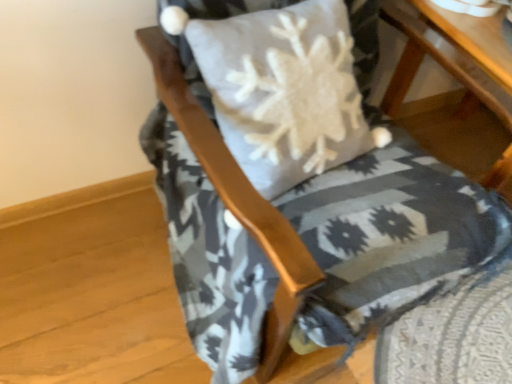
Question: Considering the relative positions of textured gray cushion at center and wooden table at lower right in the image provided, is textured gray cushion at center to the right of wooden table at lower right from the viewer's perspective?

Choices:
 (A) no
 (B) yes

Answer: (A)

Question: From a real-world perspective, is textured gray cushion at center below wooden table at lower right?

Choices:
 (A) no
 (B) yes

Answer: (A)

Question: Is wooden table at lower right at the back of textured gray cushion at center?

Choices:
 (A) yes
 (B) no

Answer: (B)

Question: Is wooden table at lower right inside textured gray cushion at center?

Choices:
 (A) yes
 (B) no

Answer: (B)

Question: From a real-world perspective, is textured gray cushion at center on wooden table at lower right?

Choices:
 (A) yes
 (B) no

Answer: (A)

Question: Is textured gray cushion at center with wooden table at lower right?

Choices:
 (A) yes
 (B) no

Answer: (B)

Question: Is the position of wooden table at lower right less distant than that of textured gray cushion at center?

Choices:
 (A) yes
 (B) no

Answer: (B)

Question: Is wooden table at lower right wider than textured gray cushion at center?

Choices:
 (A) yes
 (B) no

Answer: (B)

Question: Is wooden table at lower right touching textured gray cushion at center?

Choices:
 (A) no
 (B) yes

Answer: (A)

Question: Can we say wooden table at lower right lies outside textured gray cushion at center?

Choices:
 (A) no
 (B) yes

Answer: (B)

Question: Considering the relative positions of wooden table at lower right and textured gray cushion at center in the image provided, is wooden table at lower right to the right of textured gray cushion at center from the viewer's perspective?

Choices:
 (A) yes
 (B) no

Answer: (A)

Question: Considering the relative sizes of wooden table at lower right and textured gray cushion at center in the image provided, is wooden table at lower right shorter than textured gray cushion at center?

Choices:
 (A) yes
 (B) no

Answer: (A)

Question: Based on their positions, is textured gray cushion at center located to the left or right of wooden table at lower right?

Choices:
 (A) right
 (B) left

Answer: (B)